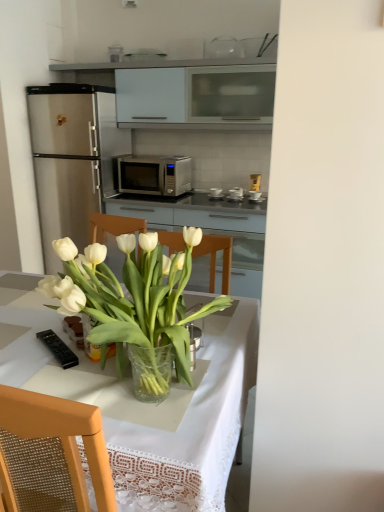
Where is `free region on the left part of black plastic remote control at lower left, the first appliance viewed from the left`? The height and width of the screenshot is (512, 384). free region on the left part of black plastic remote control at lower left, the first appliance viewed from the left is located at coordinates (22, 345).